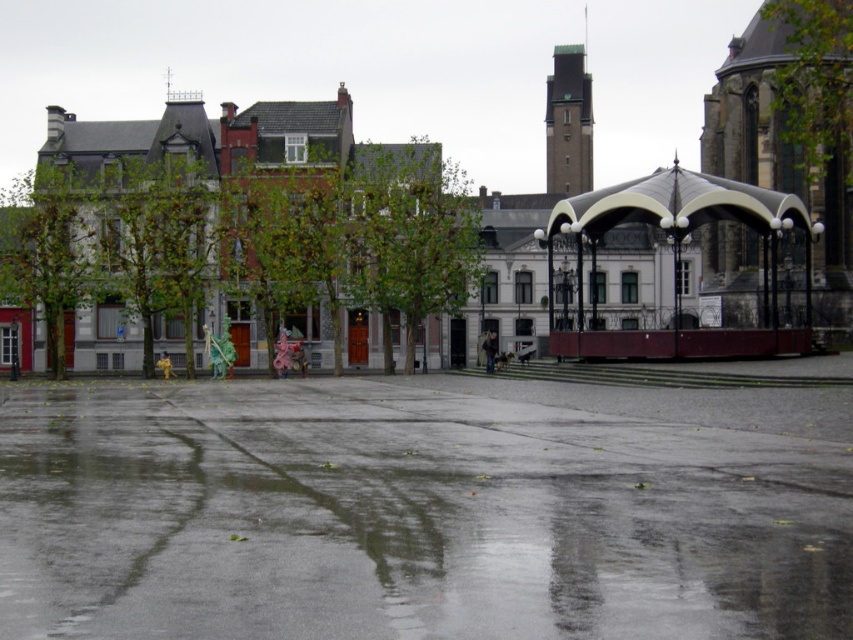
Who is positioned more to the right, glossy concrete puddle at center or metallic silver canopy at center right?

metallic silver canopy at center right

Is glossy concrete puddle at center to the left of metallic silver canopy at center right from the viewer's perspective?

Indeed, glossy concrete puddle at center is positioned on the left side of metallic silver canopy at center right.

Is point (700, 460) closer to viewer compared to point (805, 260)?

Yes, point (700, 460) is in front of point (805, 260).

You are a GUI agent. You are given a task and a screenshot of the screen. Output one action in this format:
    pyautogui.click(x=<x>, y=<y>)
    Task: Click on the glossy concrete puddle at center
    The height and width of the screenshot is (640, 853).
    Given the screenshot: What is the action you would take?
    pyautogui.click(x=422, y=513)